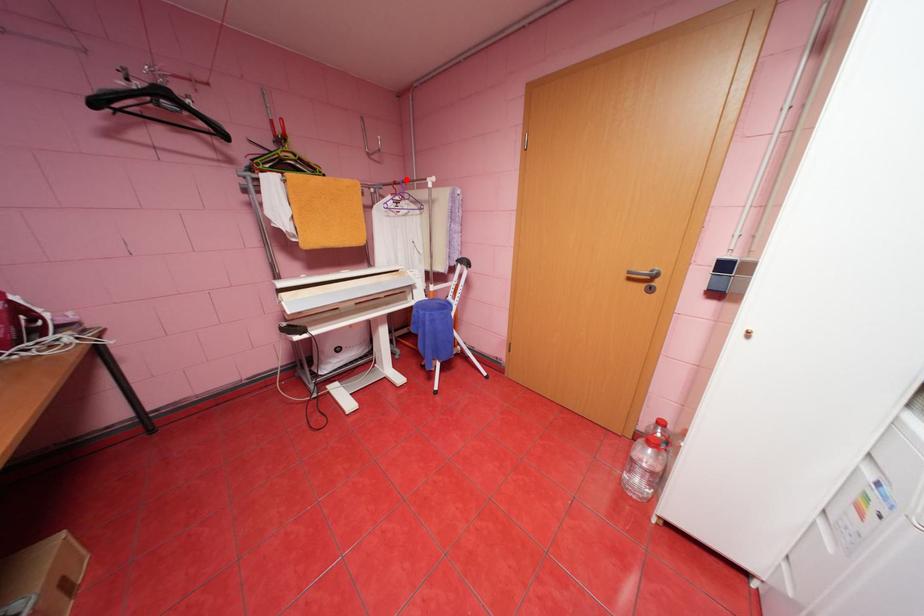
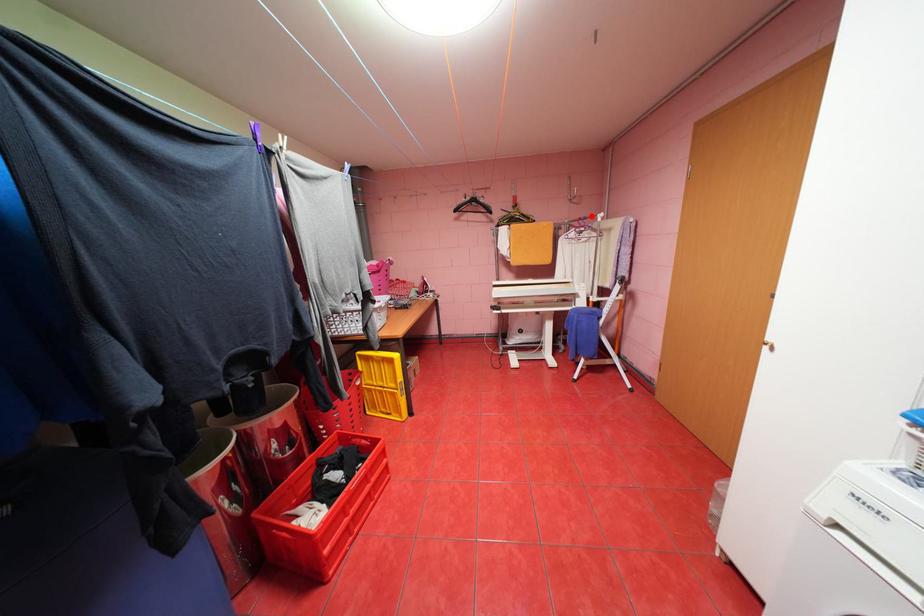
I am providing you with two images of the same scene from different viewpoints. A red point is marked on the first image and another point is marked on the second image. Do the highlighted points in image1 and image2 indicate the same real-world spot?

Yes